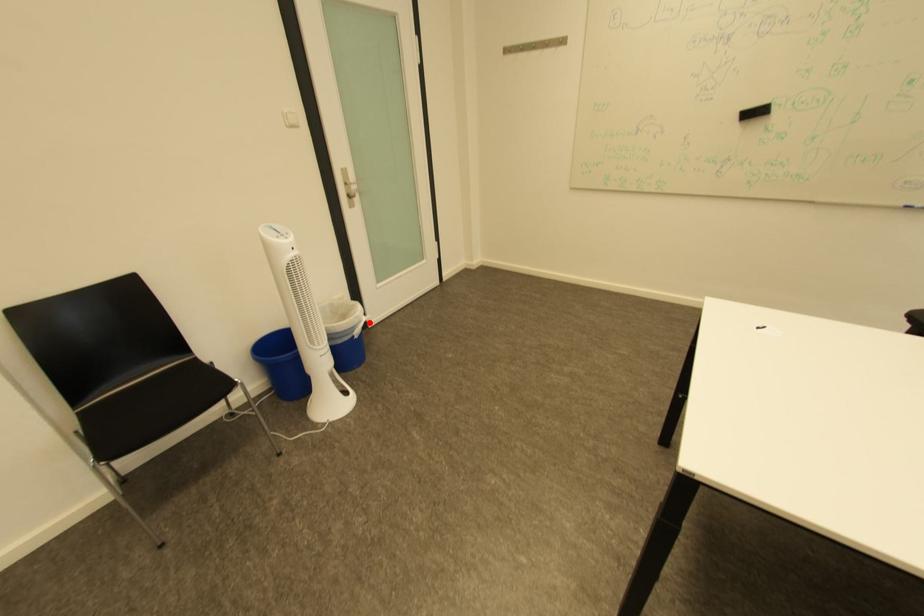
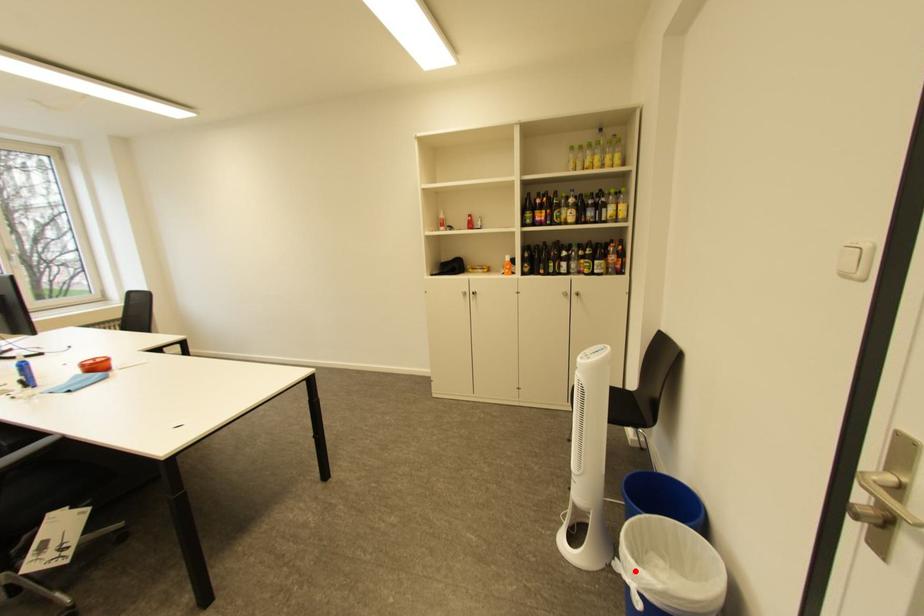
I am providing you with two images of the same scene from different viewpoints. A red point is marked on the first image and another point is marked on the second image. Are the points marked in image1 and image2 representing the same 3D position?

Yes